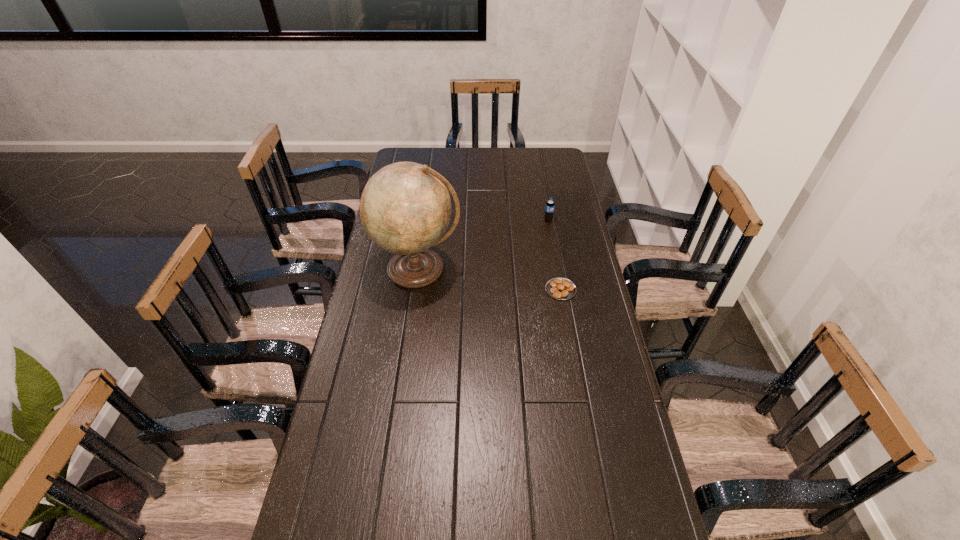
Locate an element on the screen. pastry that is at the right edge is located at coordinates (559, 288).

This screenshot has width=960, height=540. I want to click on free space at the left edge of the desktop, so click(x=398, y=289).

The height and width of the screenshot is (540, 960). I want to click on vacant area at the right edge of the desktop, so click(x=572, y=408).

I want to click on free location at the far right corner, so click(549, 158).

I want to click on vacant point located between the soda bottle and the shortest object, so click(555, 255).

I want to click on free space between the globe and the second shortest object, so click(x=483, y=245).

Select which object appears as the closest to the tallest object. Please provide its 2D coordinates. Your answer should be formatted as a tuple, i.e. [(x, y)], where the tuple contains the x and y coordinates of a point satisfying the conditions above.

[(559, 288)]

Locate which object ranks in proximity to the tallest object. Please provide its 2D coordinates. Your answer should be formatted as a tuple, i.e. [(x, y)], where the tuple contains the x and y coordinates of a point satisfying the conditions above.

[(559, 288)]

The height and width of the screenshot is (540, 960). I want to click on vacant space that satisfies the following two spatial constraints: 1. on the front-facing side of the tallest object; 2. on the right side of the shortest object, so click(416, 289).

You are a GUI agent. You are given a task and a screenshot of the screen. Output one action in this format:
    pyautogui.click(x=<x>, y=<y>)
    Task: Click on the free space that satisfies the following two spatial constraints: 1. on the front-facing side of the pastry; 2. on the right side of the globe
    
    Given the screenshot: What is the action you would take?
    pyautogui.click(x=416, y=289)